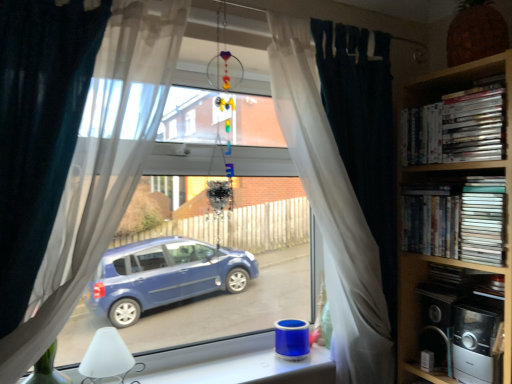
Question: Considering the relative sizes of teal fabric curtain at center, positioned as the second curtain in left-to-right order, and transparent glass window at lower center in the image provided, is teal fabric curtain at center, positioned as the second curtain in left-to-right order, thinner than transparent glass window at lower center?

Choices:
 (A) no
 (B) yes

Answer: (B)

Question: Does teal fabric curtain at center, positioned as the second curtain in left-to-right order, turn towards transparent glass window at lower center?

Choices:
 (A) yes
 (B) no

Answer: (B)

Question: From the image's perspective, is teal fabric curtain at center, positioned as the second curtain in front-to-back order, under transparent glass window at lower center?

Choices:
 (A) yes
 (B) no

Answer: (B)

Question: Does teal fabric curtain at center, which is the first curtain in back-to-front order, lie in front of transparent glass window at lower center?

Choices:
 (A) no
 (B) yes

Answer: (A)

Question: From the image's perspective, would you say teal fabric curtain at center, which is the first curtain in back-to-front order, is positioned over transparent glass window at lower center?

Choices:
 (A) yes
 (B) no

Answer: (A)

Question: Does teal fabric curtain at center, the first curtain positioned from the right, have a larger size compared to transparent glass window at lower center?

Choices:
 (A) no
 (B) yes

Answer: (B)

Question: Is metallic silver toaster at lower right, which appears as the 2th appliance when viewed from the back, turned away from white sheer curtain at center, arranged as the 2th curtain when viewed from the back?

Choices:
 (A) yes
 (B) no

Answer: (B)

Question: Is metallic silver toaster at lower right, which appears as the 2th appliance when viewed from the back, positioned beyond the bounds of white sheer curtain at center, which appears as the second curtain when viewed from the right?

Choices:
 (A) yes
 (B) no

Answer: (A)

Question: From a real-world perspective, is metallic silver toaster at lower right, which is counted as the 1th appliance, starting from the front, positioned under white sheer curtain at center, which appears as the second curtain when viewed from the right, based on gravity?

Choices:
 (A) yes
 (B) no

Answer: (A)

Question: Are metallic silver toaster at lower right, which appears as the 2th appliance when viewed from the back, and white sheer curtain at center, positioned as the 1th curtain in left-to-right order, far apart?

Choices:
 (A) yes
 (B) no

Answer: (A)

Question: Considering the relative sizes of metallic silver toaster at lower right, which appears as the 2th appliance when viewed from the back, and white sheer curtain at center, which appears as the second curtain when viewed from the right, in the image provided, is metallic silver toaster at lower right, which appears as the 2th appliance when viewed from the back, bigger than white sheer curtain at center, which appears as the second curtain when viewed from the right,?

Choices:
 (A) no
 (B) yes

Answer: (A)

Question: From the image's perspective, is metallic silver toaster at lower right, which appears as the 2th appliance when viewed from the back, over white sheer curtain at center, positioned as the 1th curtain in left-to-right order?

Choices:
 (A) no
 (B) yes

Answer: (A)

Question: Does transparent glass window at lower center have a larger size compared to metallic silver toaster at lower right, which is counted as the 1th appliance, starting from the front?

Choices:
 (A) yes
 (B) no

Answer: (A)